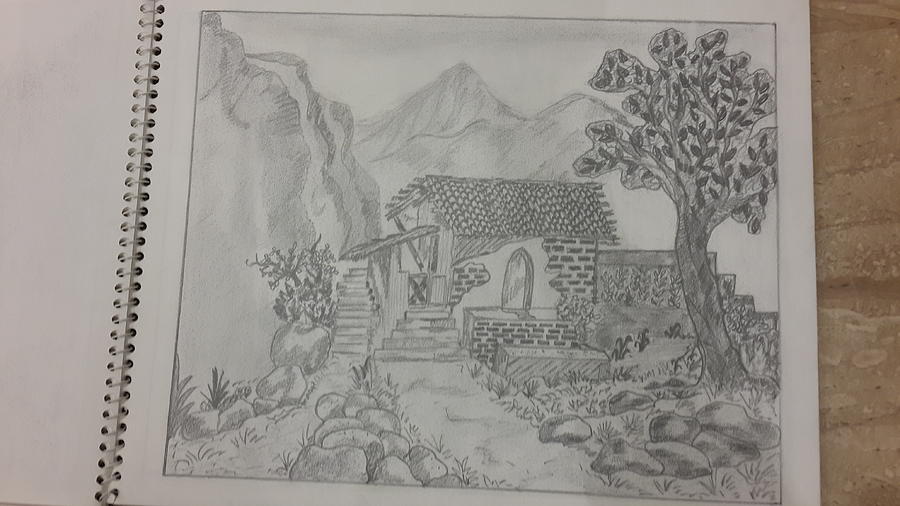
What are the coordinates of `table holding sketch pad` in the screenshot? It's located at (864, 145).